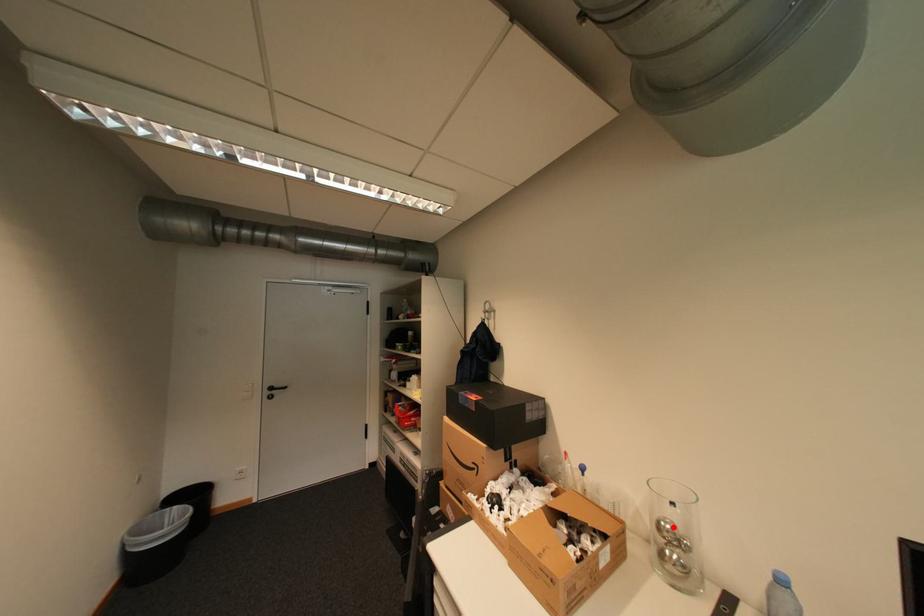
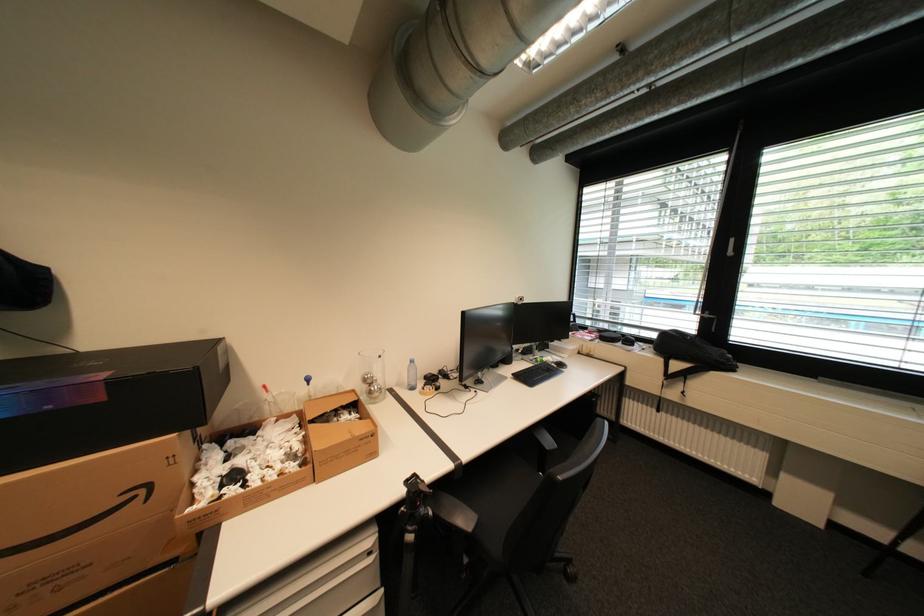
The point at the highlighted location is marked in the first image. Where is the corresponding point in the second image?

(377, 378)